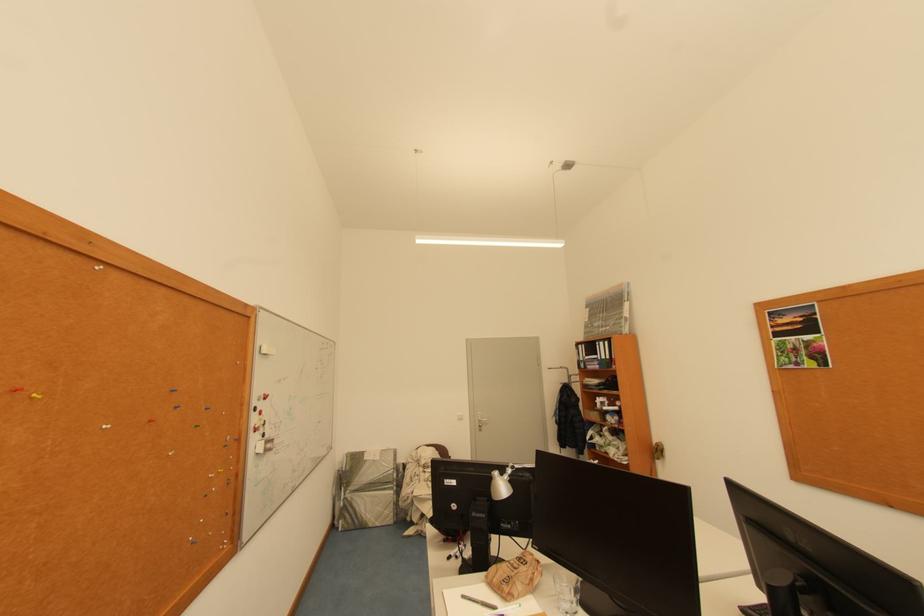
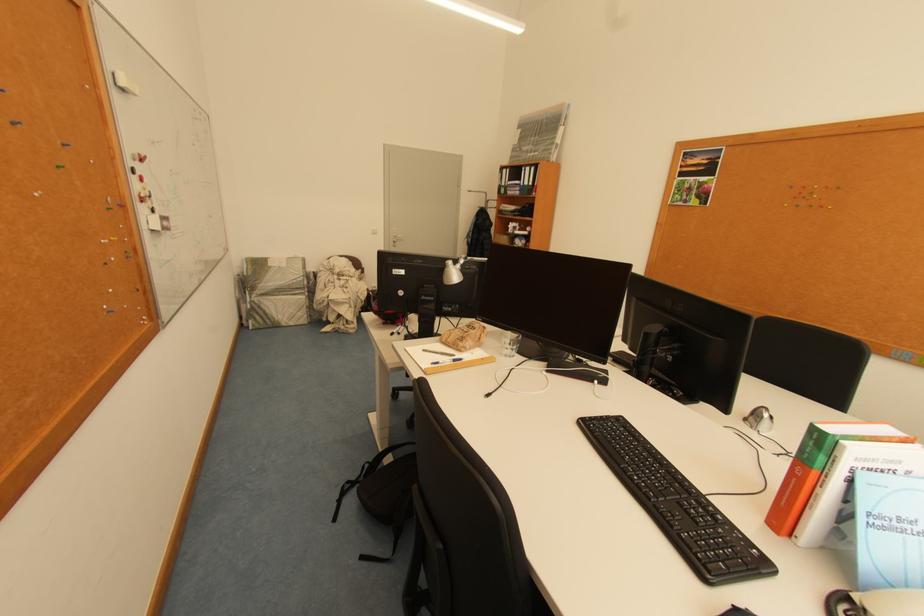
In the second image, find the point that corresponds to point (214, 411) in the first image.

(73, 147)